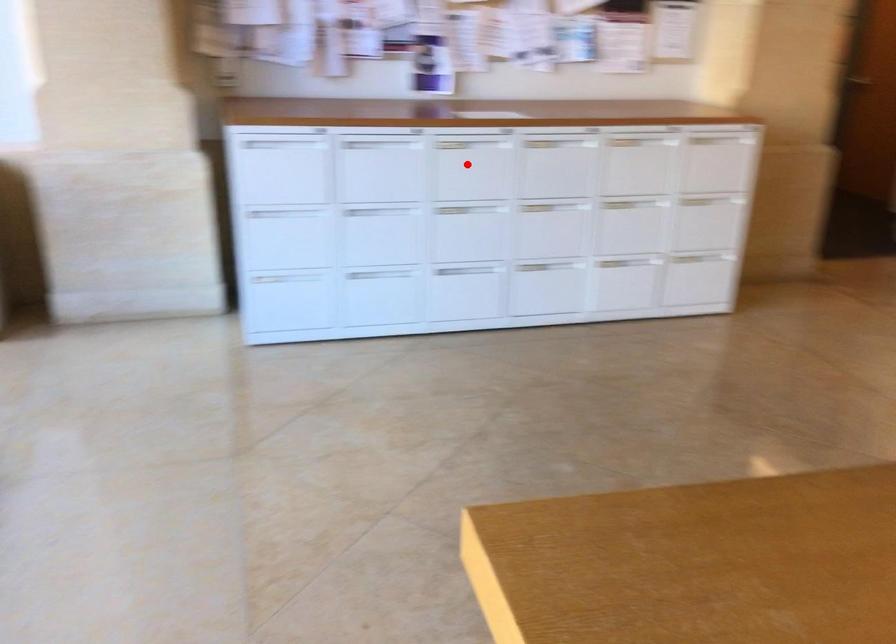
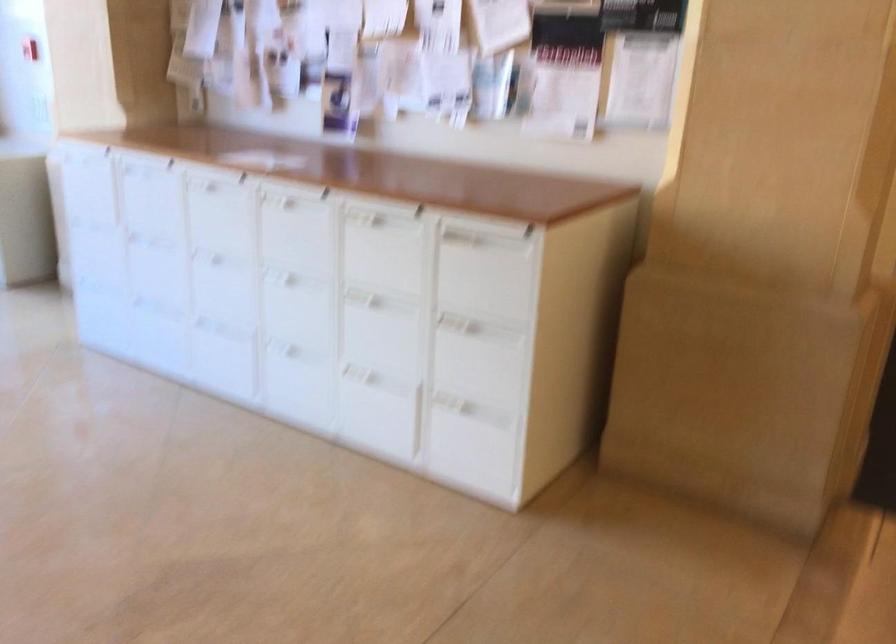
The point at the highlighted location is marked in the first image. Where is the corresponding point in the second image?

(220, 214)